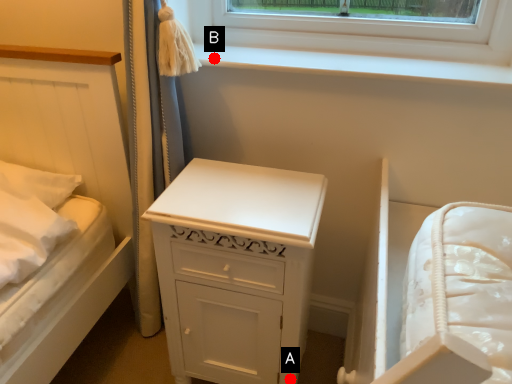
Question: Two points are circled on the image, labeled by A and B beside each circle. Which point appears closest to the camera in this image?

Choices:
 (A) A is closer
 (B) B is closer

Answer: (A)